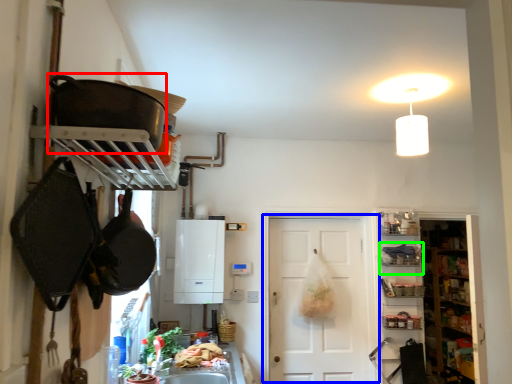
Question: Which object is positioned closest to frying pan (highlighted by a red box)? Select from door (highlighted by a blue box) and shelf (highlighted by a green box).

Choices:
 (A) door
 (B) shelf

Answer: (A)